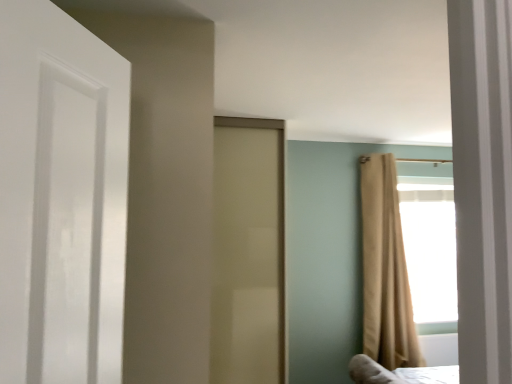
Measure the distance between point [389,189] and camera.

Point [389,189] and camera are 12.09 feet apart.

The width and height of the screenshot is (512, 384). What do you see at coordinates (385, 269) in the screenshot?
I see `beige fabric curtain at right` at bounding box center [385, 269].

Find the location of `beige fabric curtain at right`. beige fabric curtain at right is located at coordinates (385, 269).

This screenshot has height=384, width=512. Identify the location of matte beige door at center. (248, 256).

What do you see at coordinates (248, 256) in the screenshot?
I see `matte beige door at center` at bounding box center [248, 256].

What is the approximate height of matte beige door at center?

It is 2.01 meters.

The image size is (512, 384). In order to click on beige fabric curtain at right in this screenshot , I will do `click(385, 269)`.

Is matte beige door at center to the left or to the right of beige fabric curtain at right in the image?

Clearly, matte beige door at center is on the left of beige fabric curtain at right in the image.

Is matte beige door at center closer to the viewer compared to beige fabric curtain at right?

Yes, matte beige door at center is in front of beige fabric curtain at right.

Does point (257, 238) come farther from viewer compared to point (396, 256)?

That is False.

From the image's perspective, is matte beige door at center above beige fabric curtain at right?

Yes, from the image's perspective, matte beige door at center is over beige fabric curtain at right.

From a real-world perspective, who is located higher, matte beige door at center or beige fabric curtain at right?

From a 3D spatial view, matte beige door at center is above.

Does matte beige door at center have a lesser width compared to beige fabric curtain at right?

Incorrect, the width of matte beige door at center is not less than that of beige fabric curtain at right.

Considering the relative sizes of matte beige door at center and beige fabric curtain at right in the image provided, is matte beige door at center shorter than beige fabric curtain at right?

No.

Which of these two, matte beige door at center or beige fabric curtain at right, is smaller?

beige fabric curtain at right is smaller.

Is matte beige door at center positioned beyond the bounds of beige fabric curtain at right?

Indeed, matte beige door at center is completely outside beige fabric curtain at right.

Is matte beige door at center not near beige fabric curtain at right?

Yes, matte beige door at center and beige fabric curtain at right are located far from each other.

Is matte beige door at center facing away from beige fabric curtain at right?

No, matte beige door at center is not facing away from beige fabric curtain at right.

Based on the photo, how many degrees apart are the facing directions of matte beige door at center and beige fabric curtain at right?

matte beige door at center and beige fabric curtain at right are facing 1.68 degrees away from each other.

You are a GUI agent. You are given a task and a screenshot of the screen. Output one action in this format:
    pyautogui.click(x=<x>, y=<y>)
    Task: Click on the curtain that is below the matte beige door at center (from the image's perspective)
    The height and width of the screenshot is (384, 512).
    Given the screenshot: What is the action you would take?
    pyautogui.click(x=385, y=269)

Considering the positions of objects beige fabric curtain at right and matte beige door at center in the image provided, who is more to the right, beige fabric curtain at right or matte beige door at center?

Positioned to the right is beige fabric curtain at right.

Is the position of beige fabric curtain at right more distant than that of matte beige door at center?

Yes, it is.

Is point (373, 184) closer or farther from the camera than point (276, 338)?

Point (373, 184).

From the image's perspective, is beige fabric curtain at right on matte beige door at center?

No, from the image's perspective, beige fabric curtain at right is not over matte beige door at center.

From a real-world perspective, is beige fabric curtain at right located higher than matte beige door at center?

Incorrect, from a real-world perspective, beige fabric curtain at right is lower than matte beige door at center.

Considering the sizes of objects beige fabric curtain at right and matte beige door at center in the image provided, who is thinner, beige fabric curtain at right or matte beige door at center?

beige fabric curtain at right.

From their relative heights in the image, would you say beige fabric curtain at right is taller or shorter than matte beige door at center?

beige fabric curtain at right is shorter than matte beige door at center.

Considering the sizes of objects beige fabric curtain at right and matte beige door at center in the image provided, who is bigger, beige fabric curtain at right or matte beige door at center?

Bigger between the two is matte beige door at center.

Is beige fabric curtain at right not within matte beige door at center?

Yes, beige fabric curtain at right is not within matte beige door at center.

Is beige fabric curtain at right touching matte beige door at center?

No, beige fabric curtain at right is not next to matte beige door at center.

Could you tell me if beige fabric curtain at right is facing matte beige door at center?

No, beige fabric curtain at right is not facing towards matte beige door at center.

This screenshot has width=512, height=384. Find the location of `curtain below the matte beige door at center (from the image's perspective)`. curtain below the matte beige door at center (from the image's perspective) is located at coordinates (385, 269).

What are the coordinates of `door above the beige fabric curtain at right (from a real-world perspective)` in the screenshot? It's located at (248, 256).

The width and height of the screenshot is (512, 384). I want to click on curtain that is under the matte beige door at center (from a real-world perspective), so click(385, 269).